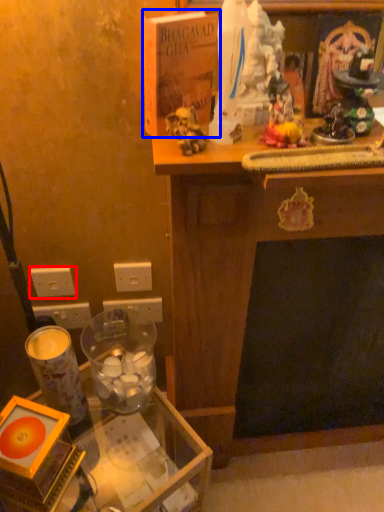
Question: Which object appears closest to the camera in this image, electric outlet (highlighted by a red box) or book (highlighted by a blue box)?

Choices:
 (A) electric outlet
 (B) book

Answer: (B)